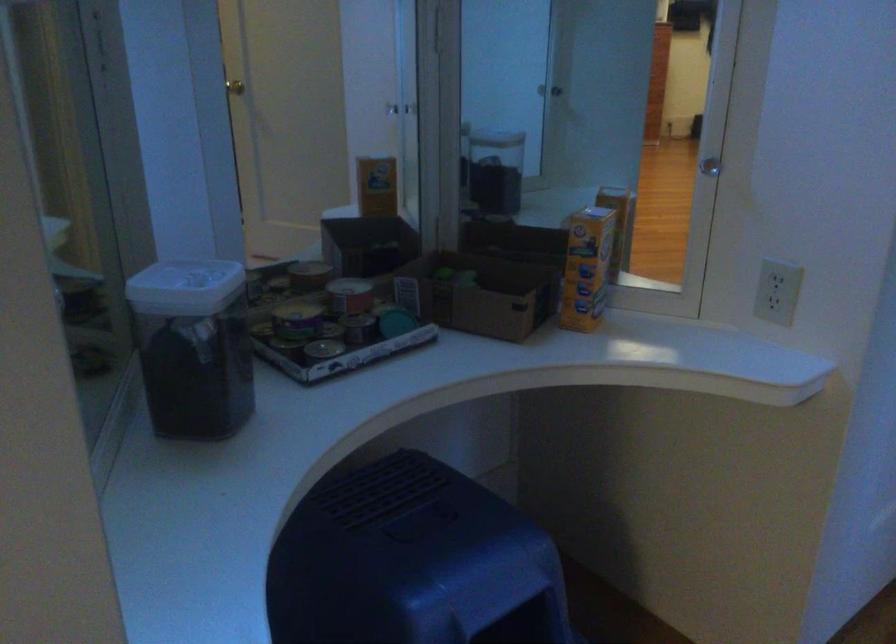
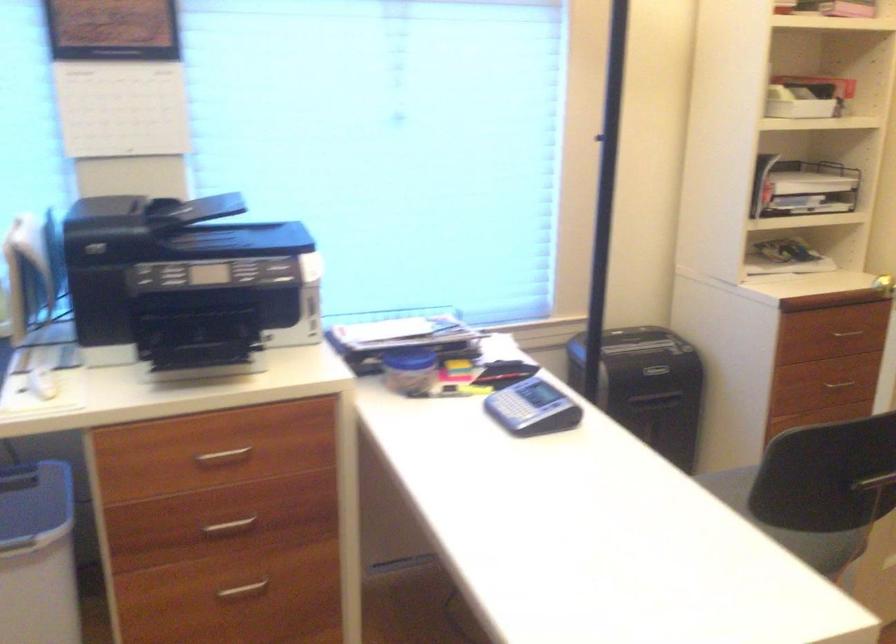
Which direction would the cameraman need to move to produce the second image?

The movement direction of the cameraman is left, backward.